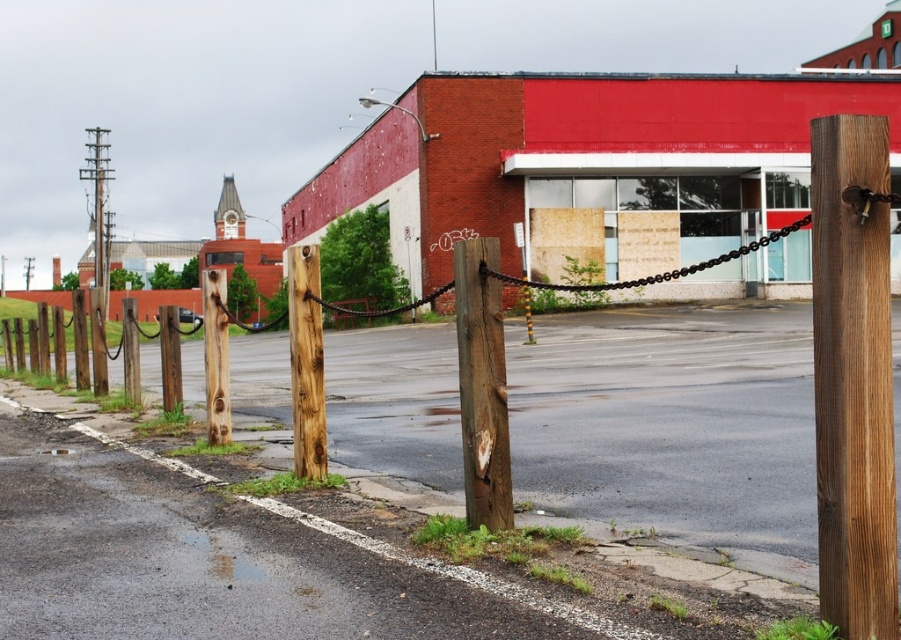
You are a delivery person trying to locate the entrance to the building. You see a point marked at coordinates (x=306, y=362). What is the object located at that point?

The point at coordinates (x=306, y=362) marks the natural wood post at center.

You are a delivery person trying to park your bike near the dark brown wood post at center and the natural wood post at center. Since the pavement is wet, you want to avoid the grassy areas. Which post should you park closer to if you want to stay on the paved area?

You should park closer to the dark brown wood post at center because it is located to the right of the natural wood post at center, and the paved area is more likely to be near the center where the posts are positioned.

You are a delivery person trying to secure a package near the fence. You need to place the package between the natural wood post at center and the brown rough wood post at left. Which post should you place it closer to if you want the package to be more visible from the street?

The natural wood post at center is shorter than the brown rough wood post at left, so placing the package closer to the natural wood post at center would make it more visible from the street since it is shorter and less obstructive.